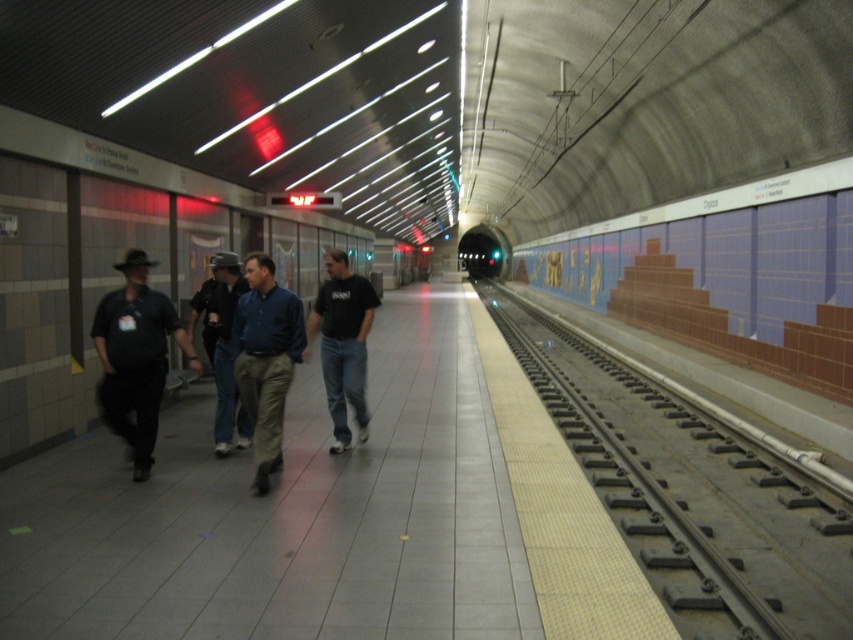
You are standing on the subway platform and want to walk towards the black metal track at right. Which direction should you move relative to the matte black shirt at left?

You should move towards the right side of the platform, as the black metal track at right is in front of the matte black shirt at left, indicating it is closer to that direction.

You are standing on the subway platform and want to reach the two points marked on the platform. Which point, point (711, 596) or point (334, 362), is closer to you?

Point (711, 596) is closer to the viewer than point (334, 362).